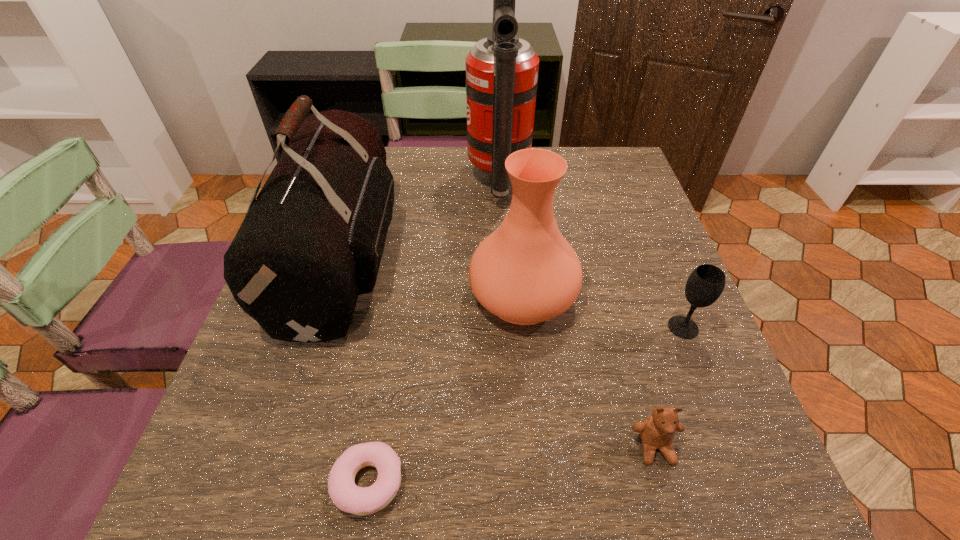
I want to click on fire extinguisher, so click(x=502, y=70).

Image resolution: width=960 pixels, height=540 pixels. In order to click on duffel bag in this screenshot , I will do `click(312, 241)`.

Locate an element on the screen. vase is located at coordinates (525, 272).

Locate an element on the screen. This screenshot has width=960, height=540. wineglass is located at coordinates (706, 283).

The height and width of the screenshot is (540, 960). What are the coordinates of `the third shortest object` in the screenshot? It's located at (706, 283).

The width and height of the screenshot is (960, 540). I want to click on teddy bear, so click(x=657, y=431).

At what (x,y) coordinates should I click in order to perform the action: click on the fifth object from left to right. Please return your answer as a coordinate pair (x, y). The image size is (960, 540). Looking at the image, I should click on (657, 431).

Find the location of a particular element. The height and width of the screenshot is (540, 960). doughnut is located at coordinates (346, 495).

At what (x,y) coordinates should I click in order to perform the action: click on vacant space located 0.200m on the front label side of the tallest object. Please return your answer as a coordinate pair (x, y). Looking at the image, I should click on (394, 181).

What are the coordinates of `free region located on the front label side of the tallest object` in the screenshot? It's located at (397, 181).